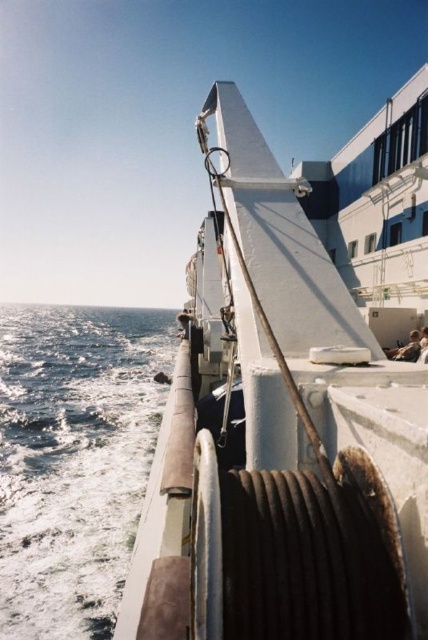
You are standing on the deck of the ship and see the white matte boat at center and the blue water at lower left. Which object is higher in elevation?

The white matte boat at center is taller than the blue water at lower left, so the white matte boat at center is higher in elevation.

You are on the deck of a ship and see the white matte boat at center and the blue water at lower left. Which object is closer to the bow of the ship?

The white matte boat at center is positioned over the blue water at lower left, so the white matte boat at center is closer to the bow of the ship.

Based on the scene description, where is the white matte boat at center located in terms of coordinates?

The white matte boat at center is located at point coordinates of (281, 432).